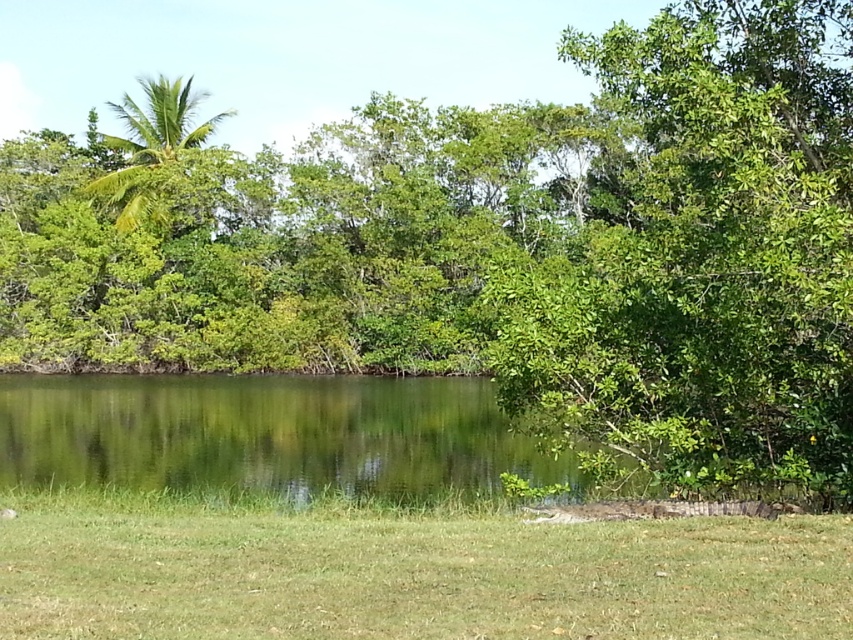
Question: Which point appears closest to the camera in this image?

Choices:
 (A) (167, 474)
 (B) (682, 42)
 (C) (402, 582)

Answer: (C)

Question: Which point appears closest to the camera in this image?

Choices:
 (A) (131, 204)
 (B) (9, 419)
 (C) (428, 518)
 (D) (808, 376)

Answer: (C)

Question: Can you confirm if green grassy at lower center is smaller than green liquid water at center?

Choices:
 (A) no
 (B) yes

Answer: (B)

Question: Among these objects, which one is farthest from the camera?

Choices:
 (A) green liquid water at center
 (B) green grassy at lower center
 (C) green leafy tree at right
 (D) green leafy palm tree at upper left

Answer: (D)

Question: Can you confirm if green liquid water at center is smaller than green leafy palm tree at upper left?

Choices:
 (A) no
 (B) yes

Answer: (B)

Question: Is green leafy tree at right to the left of green liquid water at center from the viewer's perspective?

Choices:
 (A) no
 (B) yes

Answer: (A)